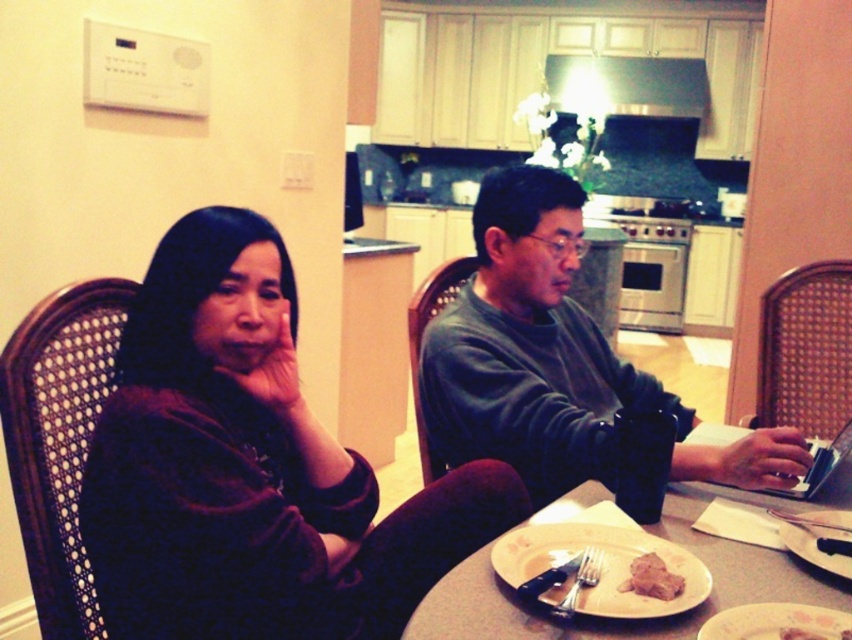
You are a small toy car that is 30 centimeters long. You want to move from the dark brown fabric at left to the white glossy plate at center. Can you fit through the space between them?

The distance between the dark brown fabric at left and the white glossy plate at center is 40.89 centimeters. Since the toy car is 30 centimeters long, it can fit through the space as 30 cm is less than 40.89 cm.

You are helping to set the table for a dinner party and need to place a decorative centerpiece that requires at least 30 cm of space. Given the dark brown fabric at left and the white glossy plate at center, which object has sufficient width to accommodate the centerpiece?

The white glossy plate at center has a greater width than the dark brown fabric at left, so it can accommodate the 30 cm required for the centerpiece.